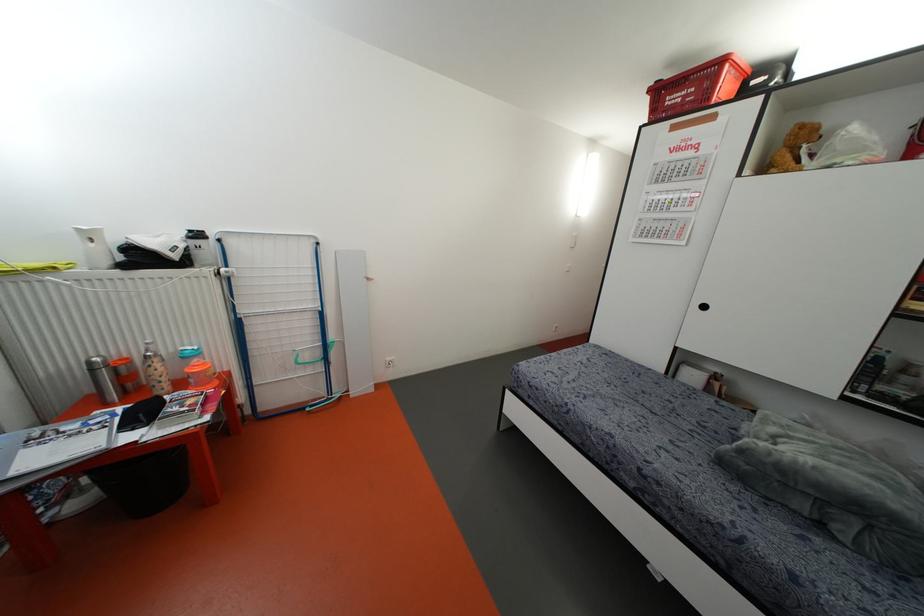
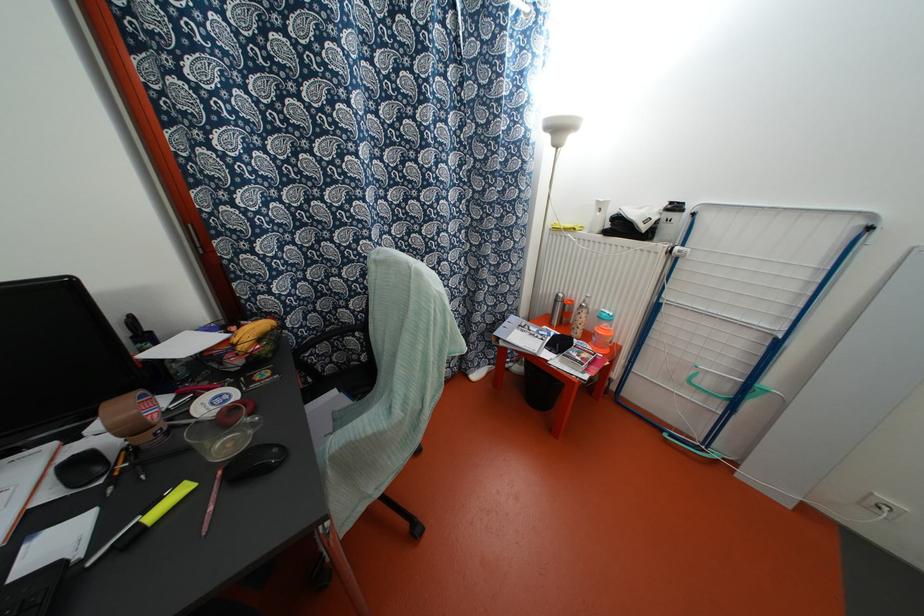
Where in the second image is the point corresponding to (x=215, y=383) from the first image?

(606, 351)